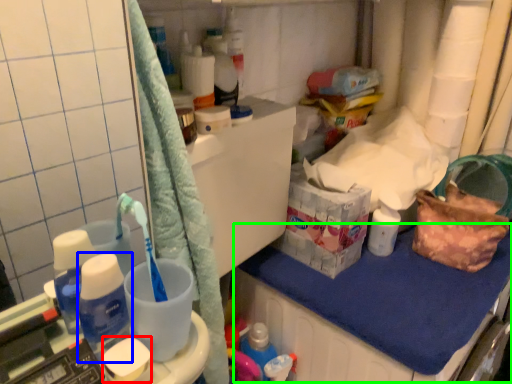
Question: Which object is the farthest from soap (highlighted by a red box)? Choose among these: bottle (highlighted by a blue box) or counter top (highlighted by a green box).

Choices:
 (A) bottle
 (B) counter top

Answer: (B)